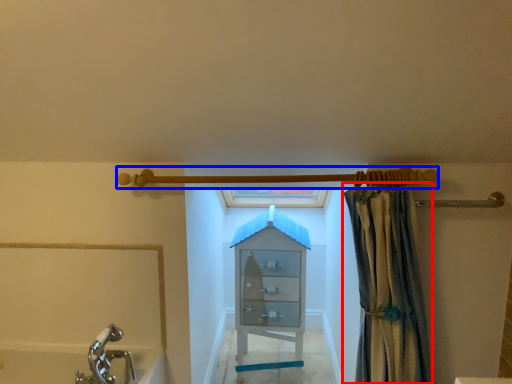
Question: Which of the following is the farthest to the observer, curtain (highlighted by a red box) or shower (highlighted by a blue box)?

Choices:
 (A) curtain
 (B) shower

Answer: (B)